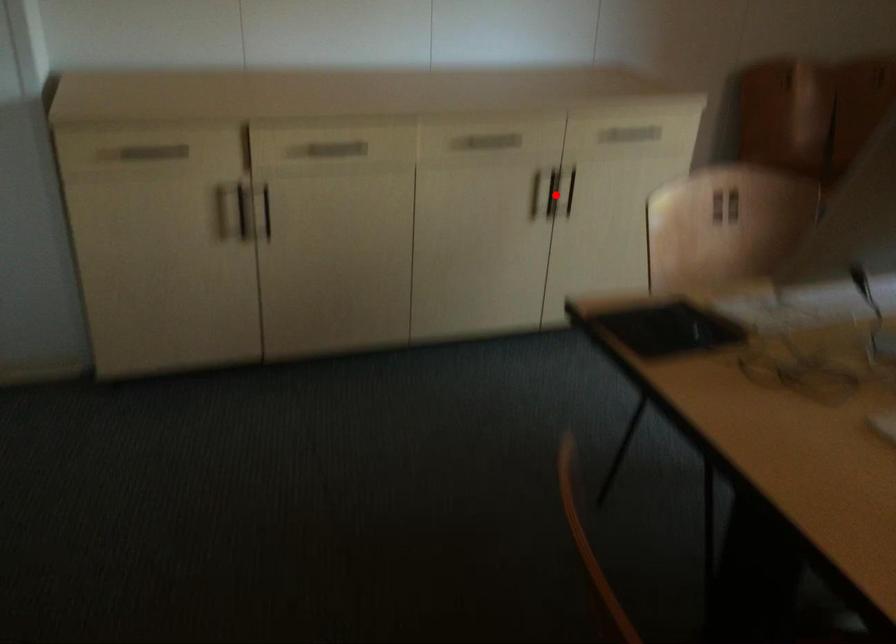
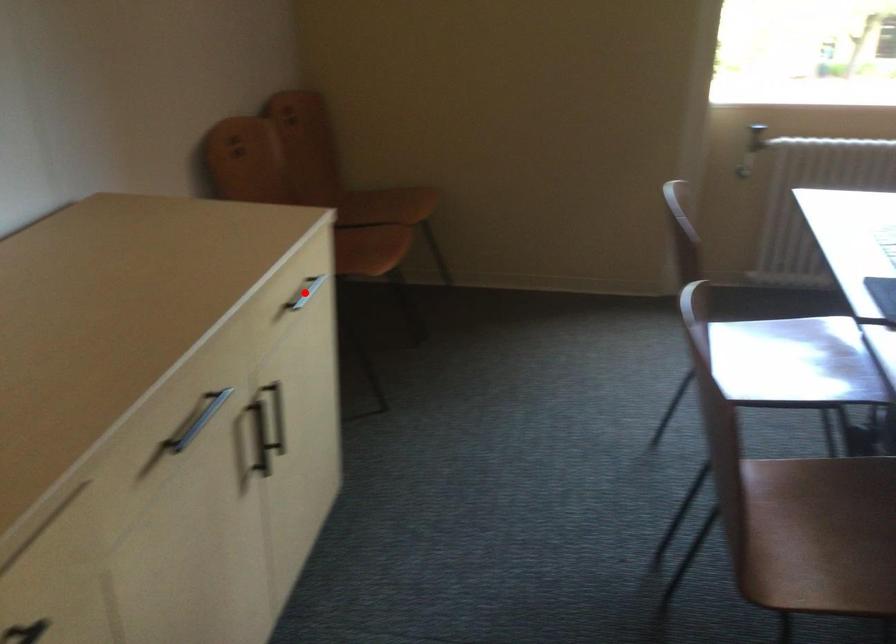
I am providing you with two images of the same scene from different viewpoints. A red point is marked on the first image and another point is marked on the second image. Are the points marked in image1 and image2 representing the same 3D position?

No